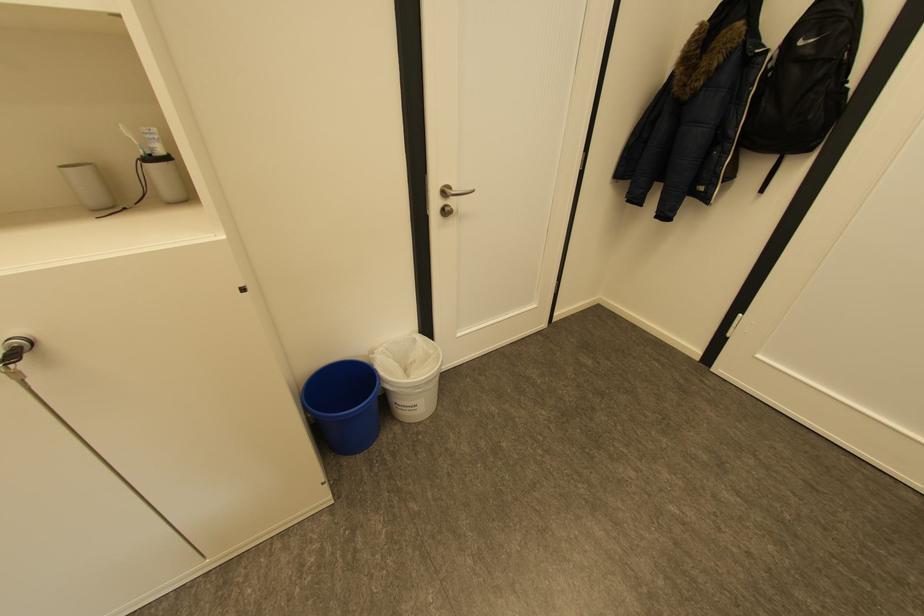
Where is `toothpaste tube`? This screenshot has width=924, height=616. toothpaste tube is located at coordinates (152, 140).